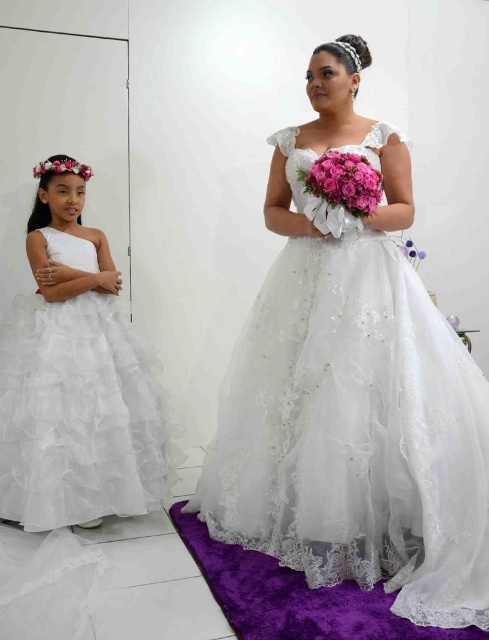
Find the location of `lace/embroidered gown at center`. lace/embroidered gown at center is located at coordinates [354, 424].

Who is more distant from viewer, (x=404, y=276) or (x=101, y=426)?

Point (x=101, y=426)

Between point (279, 308) and point (98, 316), which one is positioned in front?

Point (279, 308) is in front.

Where is `lace/embroidered gown at center`? lace/embroidered gown at center is located at coordinates (354, 424).

Is lace/embroidered gown at center below floral crown at upper left?

Indeed, lace/embroidered gown at center is positioned under floral crown at upper left.

Between lace/embroidered gown at center and floral crown at upper left, which one has more height?

lace/embroidered gown at center is taller.

Locate an element on the screen. The height and width of the screenshot is (640, 489). lace/embroidered gown at center is located at coordinates (354, 424).

Find the location of a particular element. The height and width of the screenshot is (640, 489). lace/embroidered gown at center is located at coordinates (354, 424).

Is point (347, 440) less distant than point (349, 186)?

No, it is not.

Is lace/embroidered gown at center to the left of pink satin bouquet at center from the viewer's perspective?

Yes, lace/embroidered gown at center is to the left of pink satin bouquet at center.

Is point (247, 323) farther from camera compared to point (346, 188)?

Yes, point (247, 323) is behind point (346, 188).

Locate an element on the screen. The image size is (489, 640). lace/embroidered gown at center is located at coordinates (354, 424).